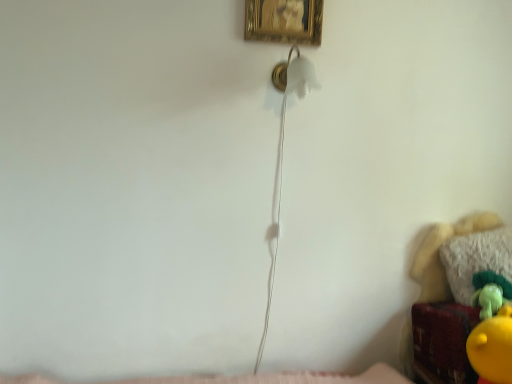
Question: In terms of width, does velvet plush toy at lower right look wider or thinner when compared to gold textured picture frame at upper center?

Choices:
 (A) wide
 (B) thin

Answer: (A)

Question: Based on their positions, is velvet plush toy at lower right located to the left or right of gold textured picture frame at upper center?

Choices:
 (A) left
 (B) right

Answer: (B)

Question: Which of these objects is positioned farthest from the white fluffy pillow at lower right?

Choices:
 (A) gold textured picture frame at upper center
 (B) velvet plush toy at lower right

Answer: (A)

Question: Estimate the real-world distances between objects in this image. Which object is farther from the gold textured picture frame at upper center?

Choices:
 (A) velvet plush toy at lower right
 (B) white fluffy pillow at lower right

Answer: (B)